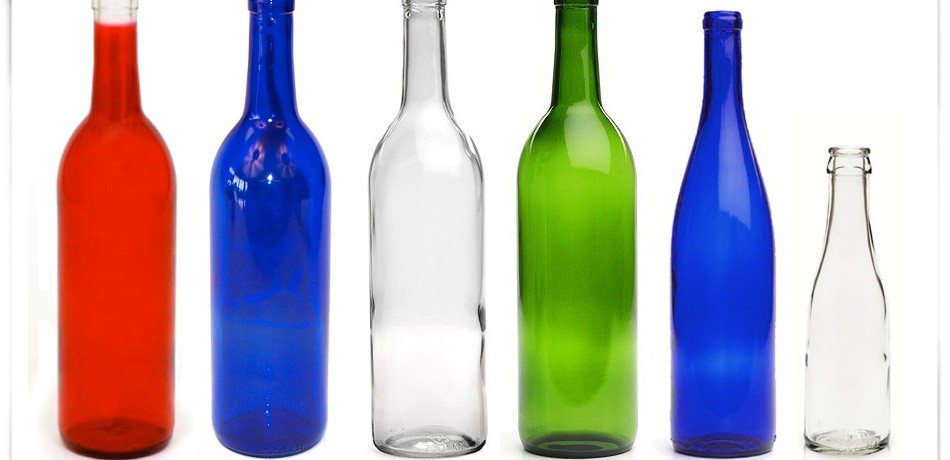
This screenshot has height=460, width=950. Identify the location of tall glass bottles. (118, 152), (256, 154), (392, 159), (553, 165), (718, 165).